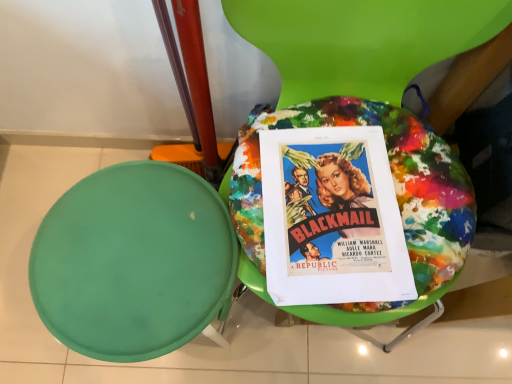
Question: Is vibrant paper poster at center facing away from green matte stool at left?

Choices:
 (A) no
 (B) yes

Answer: (A)

Question: Is vibrant paper poster at center wider than green matte stool at left?

Choices:
 (A) no
 (B) yes

Answer: (A)

Question: Considering the relative sizes of vibrant paper poster at center and green matte stool at left in the image provided, is vibrant paper poster at center shorter than green matte stool at left?

Choices:
 (A) no
 (B) yes

Answer: (B)

Question: Considering the relative sizes of vibrant paper poster at center and green matte stool at left in the image provided, is vibrant paper poster at center smaller than green matte stool at left?

Choices:
 (A) no
 (B) yes

Answer: (B)

Question: From a real-world perspective, is vibrant paper poster at center positioned under green matte stool at left based on gravity?

Choices:
 (A) no
 (B) yes

Answer: (A)

Question: Looking at their shapes, would you say green matte stool at left is wider or thinner than paint splattered fabric cushion at center?

Choices:
 (A) thin
 (B) wide

Answer: (A)

Question: Is green matte stool at left bigger or smaller than paint splattered fabric cushion at center?

Choices:
 (A) small
 (B) big

Answer: (A)

Question: From a real-world perspective, relative to paint splattered fabric cushion at center, is green matte stool at left vertically above or below?

Choices:
 (A) below
 (B) above

Answer: (A)

Question: Is green matte stool at left inside the boundaries of paint splattered fabric cushion at center, or outside?

Choices:
 (A) outside
 (B) inside

Answer: (A)

Question: From a real-world perspective, is vibrant paper poster at center physically located above or below green matte stool at left?

Choices:
 (A) below
 (B) above

Answer: (B)

Question: Relative to green matte stool at left, is vibrant paper poster at center in front or behind?

Choices:
 (A) behind
 (B) front

Answer: (A)

Question: Is vibrant paper poster at center taller or shorter than green matte stool at left?

Choices:
 (A) short
 (B) tall

Answer: (A)

Question: From the image's perspective, relative to green matte stool at left, is vibrant paper poster at center above or below?

Choices:
 (A) above
 (B) below

Answer: (A)

Question: Does point (386, 312) appear closer or farther from the camera than point (300, 283)?

Choices:
 (A) farther
 (B) closer

Answer: (A)

Question: Relative to vibrant paper poster at center, is paint splattered fabric cushion at center in front or behind?

Choices:
 (A) front
 (B) behind

Answer: (A)